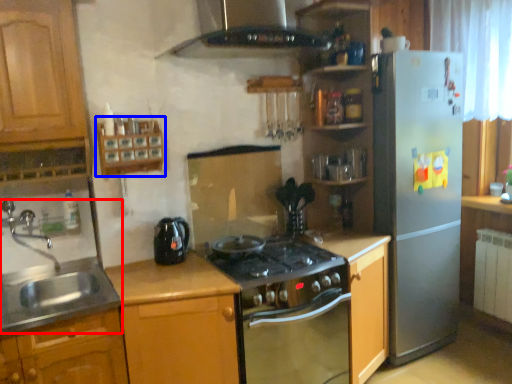
Question: Which of the following is the closest to the observer, sink (highlighted by a red box) or shelf (highlighted by a blue box)?

Choices:
 (A) sink
 (B) shelf

Answer: (A)